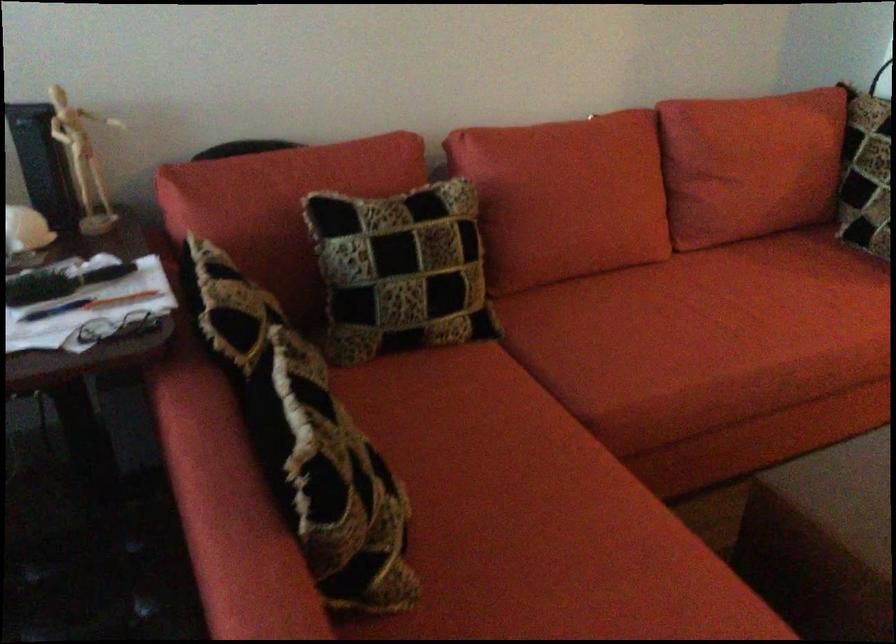
Which object does [55,310] point to?

This point indicates the blue and silver pen.